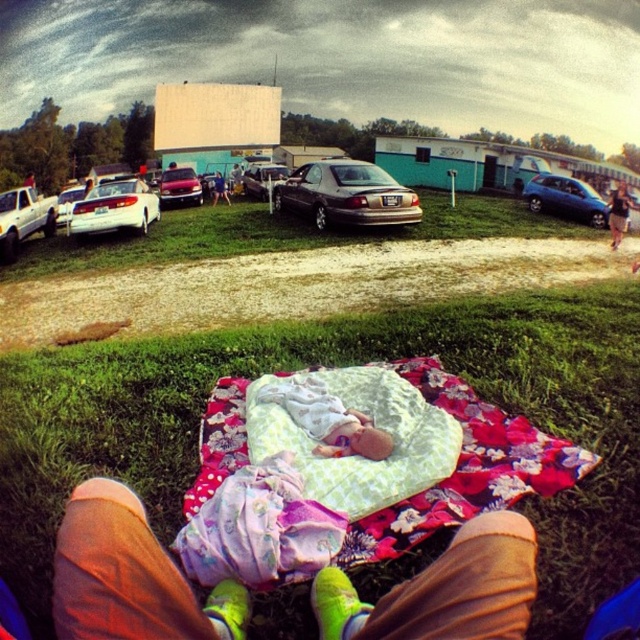
Question: Estimate the real-world distances between objects in this image. Which object is closer to the soft white blanket at center?

Choices:
 (A) blue metallic hatchback at right
 (B) smooth leather jacket at center
 (C) green grass at center

Answer: (C)

Question: Does soft white blanket at center have a smaller size compared to smooth leather jacket at center?

Choices:
 (A) yes
 (B) no

Answer: (A)

Question: Which is farther from the white glossy sedan at center?

Choices:
 (A) white matte truck at left
 (B) green grass at center

Answer: (B)

Question: Can you confirm if gold metallic sedan at center is positioned above shiny red car at center?

Choices:
 (A) no
 (B) yes

Answer: (A)

Question: Which point is farther to the camera?

Choices:
 (A) denim shorts at lower right
 (B) floral fabric blanket at center
 (C) smooth leather jacket at center

Answer: (C)

Question: Is brown fabric pants at lower center above denim shorts at lower right?

Choices:
 (A) no
 (B) yes

Answer: (A)